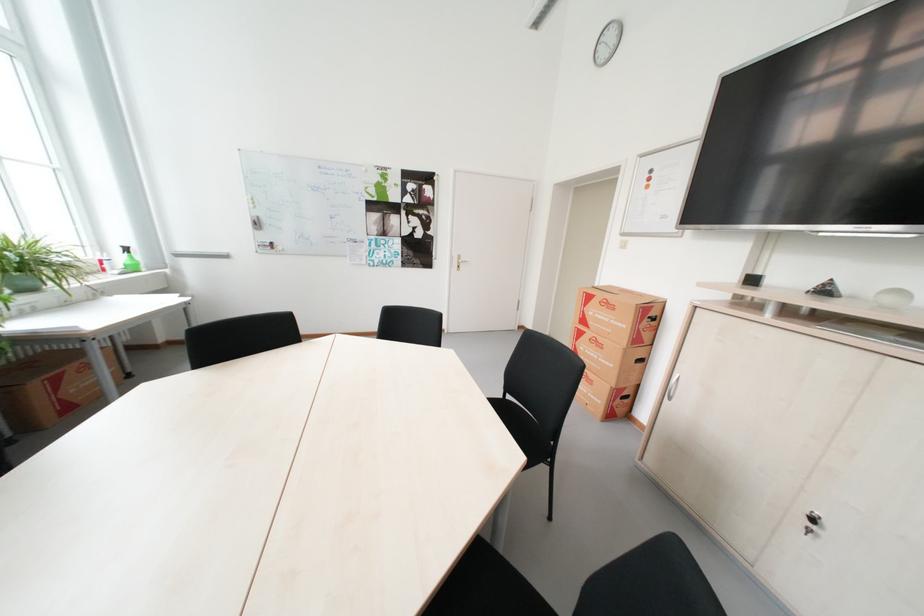
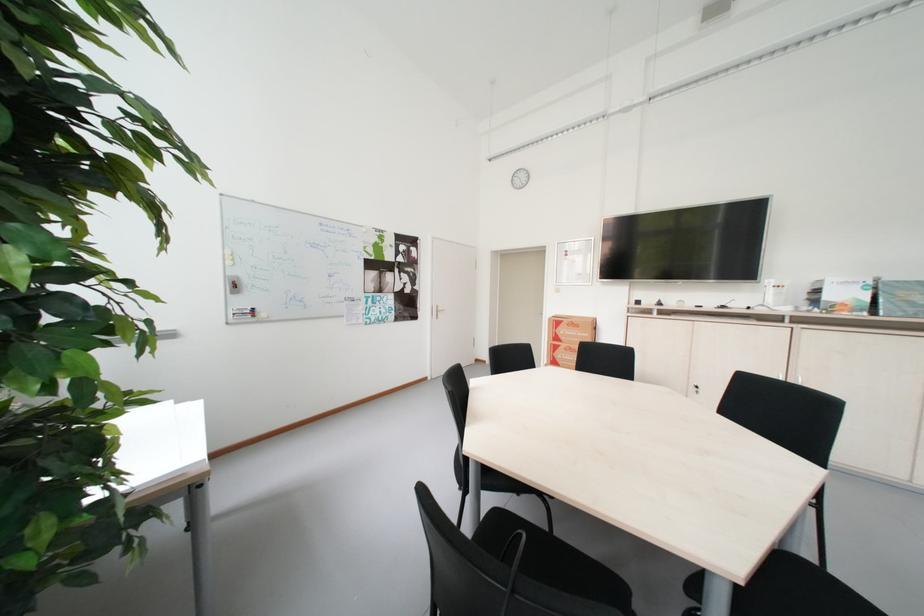
Find the pixel in the second image that matches point 593,323 in the first image.

(565, 341)